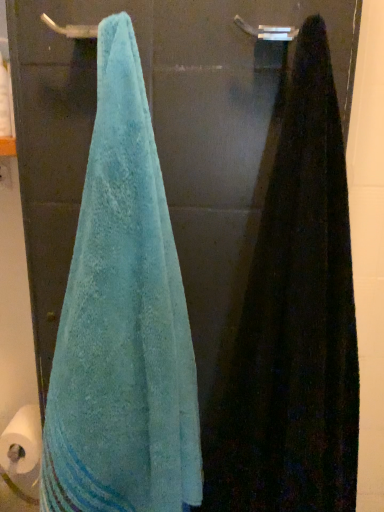
Question: Can you confirm if black fuzzy towel at right, marked as the 1th towel in a right-to-left arrangement, is bigger than silver metallic towel bar at upper center?

Choices:
 (A) yes
 (B) no

Answer: (A)

Question: Does black fuzzy towel at right, the second towel viewed from the left, have a greater height compared to silver metallic towel bar at upper center?

Choices:
 (A) no
 (B) yes

Answer: (B)

Question: Would you say black fuzzy towel at right, marked as the 1th towel in a right-to-left arrangement, contains silver metallic towel bar at upper center?

Choices:
 (A) no
 (B) yes

Answer: (A)

Question: Considering the relative sizes of black fuzzy towel at right, the second towel viewed from the left, and silver metallic towel bar at upper center in the image provided, is black fuzzy towel at right, the second towel viewed from the left, shorter than silver metallic towel bar at upper center?

Choices:
 (A) yes
 (B) no

Answer: (B)

Question: From the image's perspective, is black fuzzy towel at right, the second towel viewed from the left, over silver metallic towel bar at upper center?

Choices:
 (A) yes
 (B) no

Answer: (B)

Question: From the image's perspective, is teal terry cloth towel at left, the 1th towel in the left-to-right sequence, above or below silver metallic towel bar at upper center?

Choices:
 (A) below
 (B) above

Answer: (A)

Question: In terms of size, does teal terry cloth towel at left, the 2th towel positioned from the right, appear bigger or smaller than silver metallic towel bar at upper center?

Choices:
 (A) small
 (B) big

Answer: (B)

Question: From a real-world perspective, is teal terry cloth towel at left, the 1th towel in the left-to-right sequence, positioned above or below silver metallic towel bar at upper center?

Choices:
 (A) above
 (B) below

Answer: (B)

Question: Based on their positions, is teal terry cloth towel at left, the 1th towel in the left-to-right sequence, located to the left or right of silver metallic towel bar at upper center?

Choices:
 (A) right
 (B) left

Answer: (B)

Question: From the image's perspective, is black fuzzy towel at right, marked as the 1th towel in a right-to-left arrangement, above or below teal terry cloth towel at left, the 1th towel in the left-to-right sequence?

Choices:
 (A) below
 (B) above

Answer: (A)

Question: Considering the positions of black fuzzy towel at right, the second towel viewed from the left, and teal terry cloth towel at left, the 2th towel positioned from the right, in the image, is black fuzzy towel at right, the second towel viewed from the left, bigger or smaller than teal terry cloth towel at left, the 2th towel positioned from the right,?

Choices:
 (A) small
 (B) big

Answer: (B)

Question: Considering the positions of point (347, 443) and point (72, 368), is point (347, 443) closer or farther from the camera than point (72, 368)?

Choices:
 (A) farther
 (B) closer

Answer: (A)

Question: Visually, is black fuzzy towel at right, marked as the 1th towel in a right-to-left arrangement, positioned to the left or to the right of teal terry cloth towel at left, the 1th towel in the left-to-right sequence?

Choices:
 (A) right
 (B) left

Answer: (A)

Question: Is silver metallic towel bar at upper center in front of or behind black fuzzy towel at right, the second towel viewed from the left, in the image?

Choices:
 (A) front
 (B) behind

Answer: (B)

Question: In terms of size, does silver metallic towel bar at upper center appear bigger or smaller than black fuzzy towel at right, the second towel viewed from the left?

Choices:
 (A) small
 (B) big

Answer: (A)